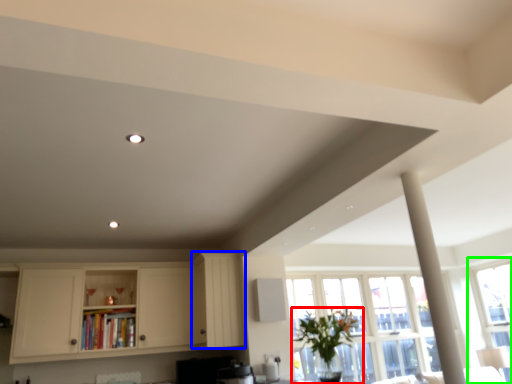
Question: Which is farther away from houseplant (highlighted by a red box)? cabinetry (highlighted by a blue box) or window (highlighted by a green box)?

Choices:
 (A) cabinetry
 (B) window

Answer: (B)